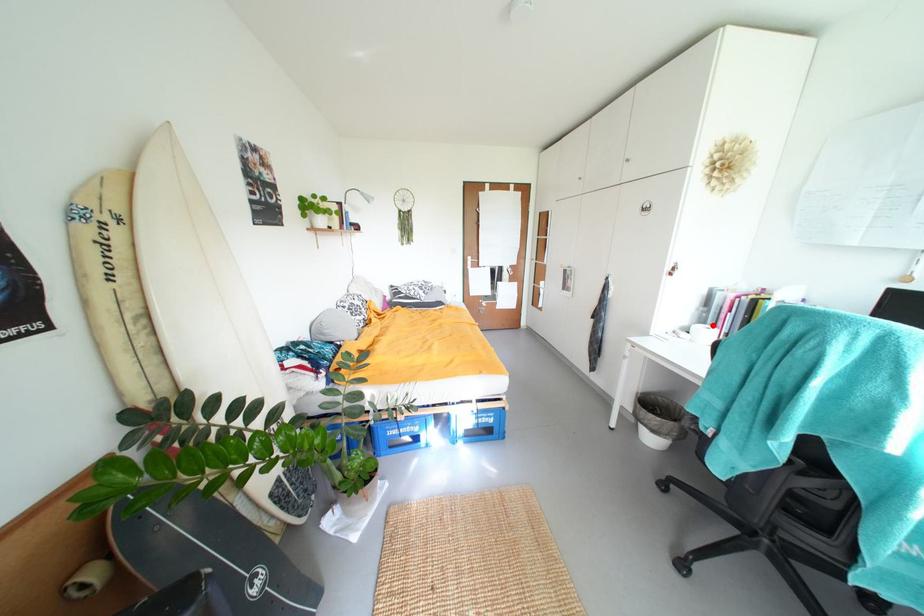
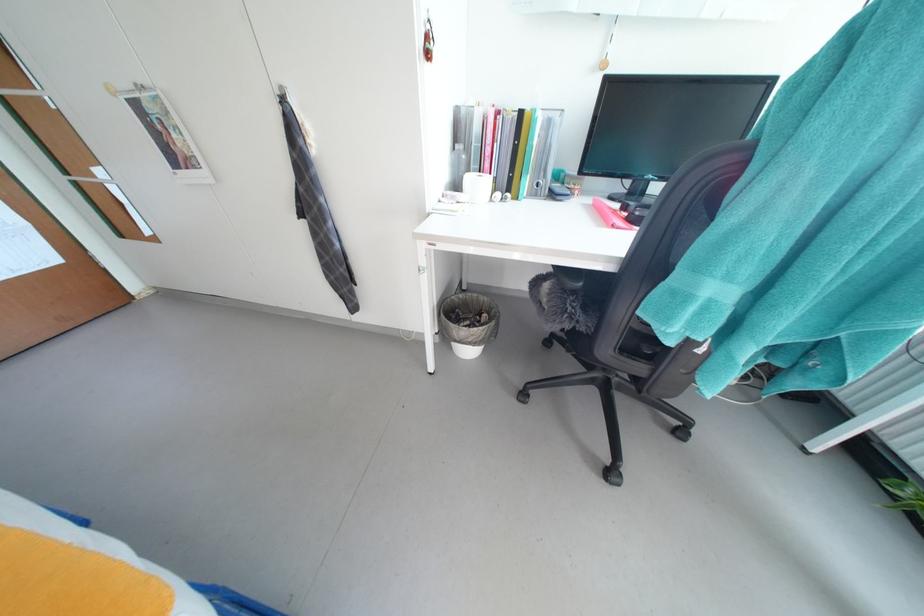
Question: I am providing you with two images of the same scene from different viewpoints. A red point is marked on the first image. Can you still see the location of the red point in image 2?

Choices:
 (A) Yes
 (B) No

Answer: (A)